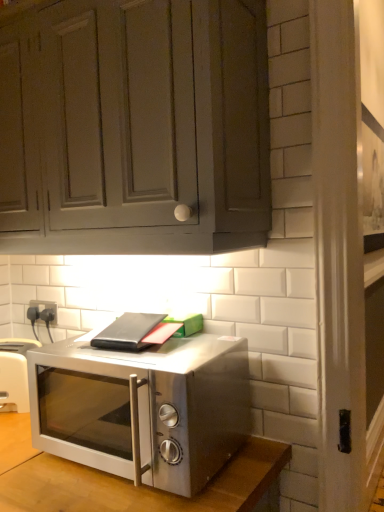
Question: Would you say satin silver microwave at center is inside or outside matte gray cabinet at upper center?

Choices:
 (A) inside
 (B) outside

Answer: (B)

Question: Relative to matte gray cabinet at upper center, is satin silver microwave at center in front or behind?

Choices:
 (A) behind
 (B) front

Answer: (A)

Question: Which object is the closest to the matte gray cabinet at upper center?

Choices:
 (A) satin silver toaster at lower left
 (B) satin silver microwave at center

Answer: (B)

Question: Estimate the real-world distances between objects in this image. Which object is farther from the matte gray cabinet at upper center?

Choices:
 (A) satin silver microwave at center
 (B) satin silver toaster at lower left

Answer: (B)